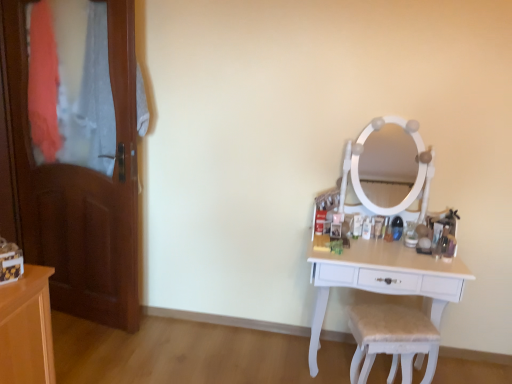
Where is `free space between white wood table at right and wooden door at left`? This screenshot has width=512, height=384. free space between white wood table at right and wooden door at left is located at coordinates (233, 349).